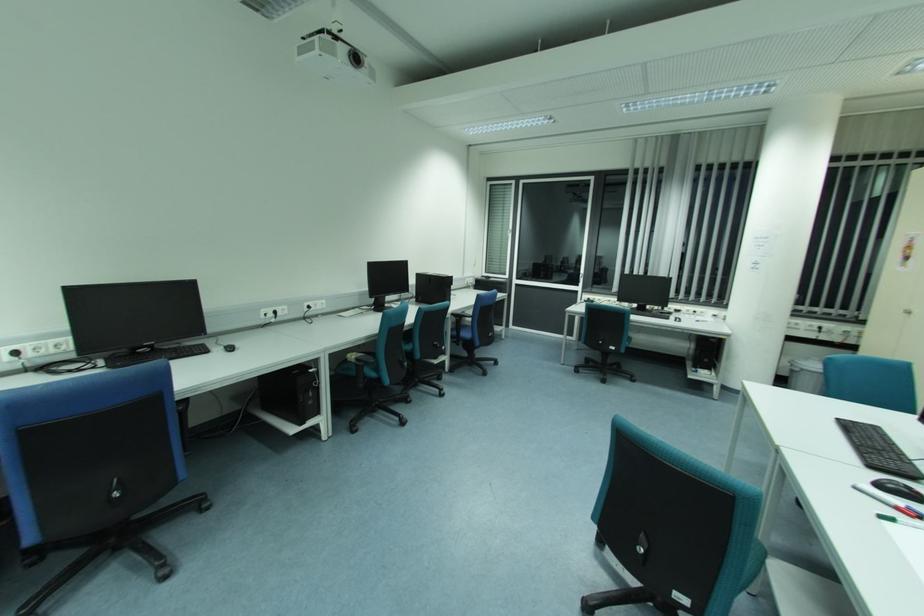
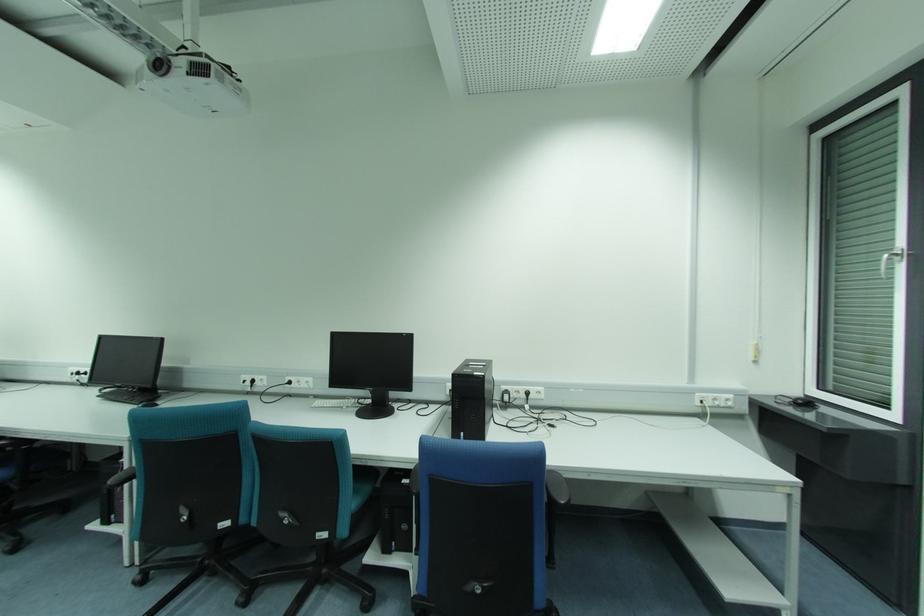
Locate, in the second image, the point that corresponds to point (310, 307) in the first image.

(289, 383)